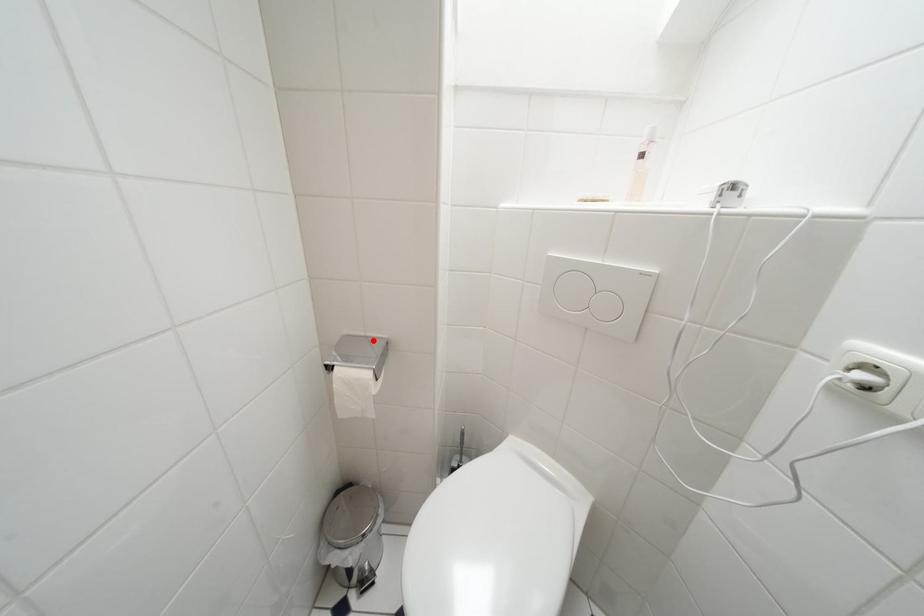
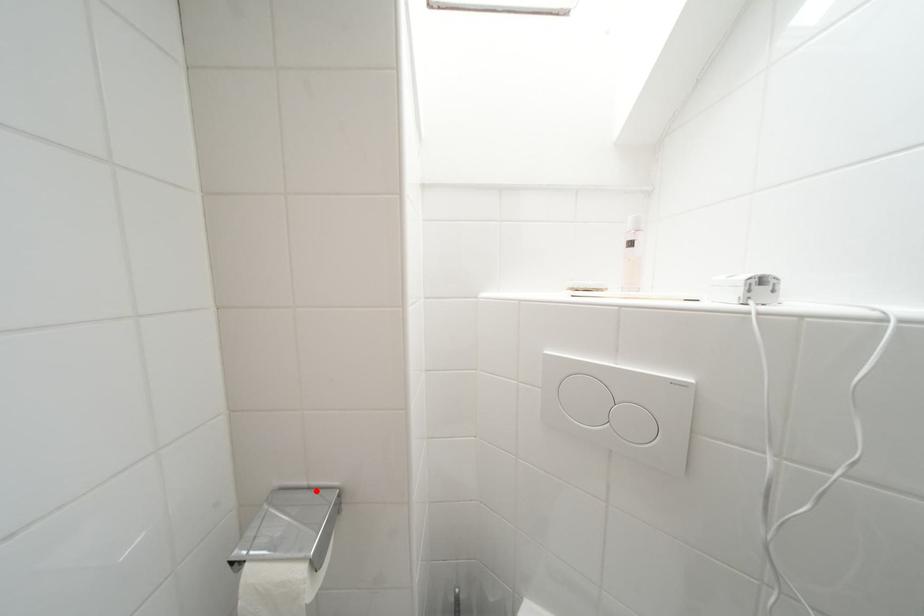
I am providing you with two images of the same scene from different viewpoints. A red point is marked on the first image and another point is marked on the second image. Do the highlighted points in image1 and image2 indicate the same real-world spot?

Yes